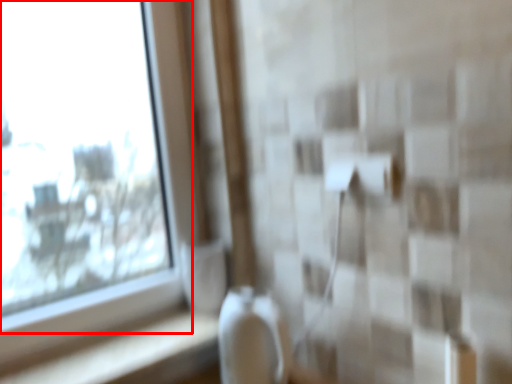
Question: Where is window (annotated by the red box) located in relation to ledge in the image?

Choices:
 (A) right
 (B) left

Answer: (B)